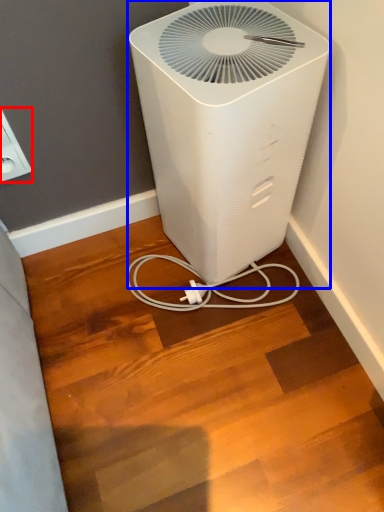
Question: Among these objects, which one is nearest to the camera, electric outlet (highlighted by a red box) or home appliance (highlighted by a blue box)?

Choices:
 (A) electric outlet
 (B) home appliance

Answer: (B)